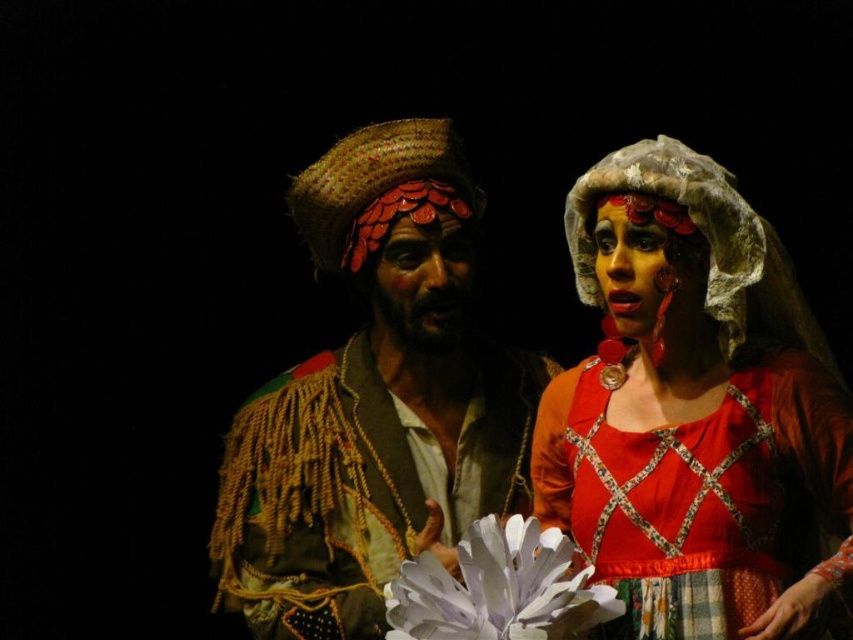
Question: In this image, where is matte red dress at center located relative to matte red fabric at center?

Choices:
 (A) above
 (B) below

Answer: (B)

Question: Which point is farther to the camera?

Choices:
 (A) matte red fabric at center
 (B) textured straw hat at center
 (C) matte red scales at center
 (D) matte red dress at center

Answer: (C)

Question: Which of the following is the farthest from the observer?

Choices:
 (A) matte red dress at center
 (B) textured straw hat at center

Answer: (B)

Question: Is matte red dress at center to the left of textured straw hat at center from the viewer's perspective?

Choices:
 (A) yes
 (B) no

Answer: (B)

Question: Which point is closer to the camera taking this photo?

Choices:
 (A) (286, 628)
 (B) (606, 241)

Answer: (B)

Question: Does textured straw hat at center have a greater width compared to matte red scales at center?

Choices:
 (A) no
 (B) yes

Answer: (B)